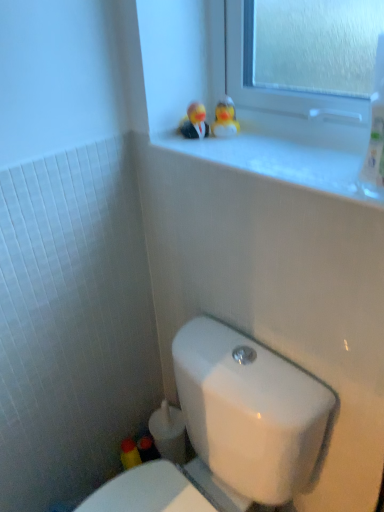
What is the approximate width of white glossy toilet at lower center?

white glossy toilet at lower center is 23.71 inches wide.

What is the approximate width of white glossy window sill at upper center?

9.50 inches.

What is the approximate height of white glossy window sill at upper center?

white glossy window sill at upper center is 0.57 inches tall.

What do you see at coordinates (194, 122) in the screenshot? Image resolution: width=384 pixels, height=512 pixels. I see `rubber duck at upper center, the second miniature from the right` at bounding box center [194, 122].

Where is `rubber duckies at upper center, the 2th miniature when ordered from left to right`? This screenshot has width=384, height=512. rubber duckies at upper center, the 2th miniature when ordered from left to right is located at coordinates (225, 119).

Locate an element on the screen. The image size is (384, 512). white glossy toilet at lower center is located at coordinates (231, 428).

What are the coordinates of `toilet in front of the rubber duckies at upper center, the 2th miniature when ordered from left to right` in the screenshot? It's located at (231, 428).

Based on the photo, what's the angular difference between rubber duckies at upper center, which is the first miniature in right-to-left order, and white glossy toilet at lower center's facing directions?

The angular difference between rubber duckies at upper center, which is the first miniature in right-to-left order, and white glossy toilet at lower center is 54.6 degrees.

In the scene shown: Is rubber duckies at upper center, which is the first miniature in right-to-left order, positioned far away from white glossy toilet at lower center?

No, there isn't a large distance between rubber duckies at upper center, which is the first miniature in right-to-left order, and white glossy toilet at lower center.

Considering the relative sizes of rubber duckies at upper center, the 2th miniature when ordered from left to right, and white glossy toilet at lower center in the image provided, is rubber duckies at upper center, the 2th miniature when ordered from left to right, shorter than white glossy toilet at lower center?

Yes.

In the image, there is a rubber duckies at upper center, the 2th miniature when ordered from left to right. At what (x,y) coordinates should I click in order to perform the action: click on window sill below it (from the image's perspective). Please return your answer as a coordinate pair (x, y). Looking at the image, I should click on (289, 155).

Is rubber duckies at upper center, which is the first miniature in right-to-left order, inside white glossy window sill at upper center?

No, rubber duckies at upper center, which is the first miniature in right-to-left order, is not a part of white glossy window sill at upper center.

Which of these two, white glossy window sill at upper center or rubber duckies at upper center, which is the first miniature in right-to-left order, is wider?

With larger width is white glossy window sill at upper center.

Is white glossy toilet at lower center bigger than rubber duck at upper center, the second miniature from the right?

Yes.

From the image's perspective, is white glossy toilet at lower center over rubber duck at upper center, placed as the 1th miniature when sorted from left to right?

No.

Is white glossy toilet at lower center looking in the opposite direction of rubber duck at upper center, the second miniature from the right?

No, white glossy toilet at lower center is not facing away from rubber duck at upper center, the second miniature from the right.

How far apart are white glossy toilet at lower center and rubber duck at upper center, the second miniature from the right?

white glossy toilet at lower center is 28.00 inches away from rubber duck at upper center, the second miniature from the right.

Can you confirm if rubber duckies at upper center, the 2th miniature when ordered from left to right, is smaller than white glossy window sill at upper center?

Yes.

Is rubber duckies at upper center, which is the first miniature in right-to-left order, completely or partially outside of white glossy window sill at upper center?

That's correct, rubber duckies at upper center, which is the first miniature in right-to-left order, is outside of white glossy window sill at upper center.

Can you tell me how much rubber duckies at upper center, which is the first miniature in right-to-left order, and white glossy window sill at upper center differ in facing direction?

Answer: The facing directions of rubber duckies at upper center, which is the first miniature in right-to-left order, and white glossy window sill at upper center are 52.7 degrees apart.

How far apart are rubber duck at upper center, placed as the 1th miniature when sorted from left to right, and white glossy window sill at upper center?

24.56 centimeters.

From the image's perspective, is rubber duck at upper center, the second miniature from the right, on top of white glossy window sill at upper center?

Yes, from the image's perspective, rubber duck at upper center, the second miniature from the right, is over white glossy window sill at upper center.

Considering the sizes of objects rubber duck at upper center, the second miniature from the right, and white glossy window sill at upper center in the image provided, who is bigger, rubber duck at upper center, the second miniature from the right, or white glossy window sill at upper center?

Bigger between the two is white glossy window sill at upper center.

Is there a large distance between rubber duck at upper center, the second miniature from the right, and white glossy window sill at upper center?

No.

Can you see rubber duck at upper center, placed as the 1th miniature when sorted from left to right, touching white glossy toilet at lower center?

No, rubber duck at upper center, placed as the 1th miniature when sorted from left to right, is not making contact with white glossy toilet at lower center.

Considering the relative sizes of rubber duck at upper center, the second miniature from the right, and white glossy toilet at lower center in the image provided, is rubber duck at upper center, the second miniature from the right, shorter than white glossy toilet at lower center?

Yes, rubber duck at upper center, the second miniature from the right, is shorter than white glossy toilet at lower center.

Considering the relative sizes of rubber duck at upper center, the second miniature from the right, and white glossy toilet at lower center in the image provided, is rubber duck at upper center, the second miniature from the right, wider than white glossy toilet at lower center?

Incorrect, the width of rubber duck at upper center, the second miniature from the right, does not surpass that of white glossy toilet at lower center.

Considering the positions of objects rubber duck at upper center, the second miniature from the right, and white glossy toilet at lower center in the image provided, who is more to the left, rubber duck at upper center, the second miniature from the right, or white glossy toilet at lower center?

white glossy toilet at lower center is more to the left.

Is white glossy window sill at upper center inside or outside of white glossy toilet at lower center?

white glossy window sill at upper center is located beyond the bounds of white glossy toilet at lower center.

Between white glossy window sill at upper center and white glossy toilet at lower center, which one has larger width?

With larger width is white glossy toilet at lower center.

From the picture: What's the angular difference between white glossy window sill at upper center and white glossy toilet at lower center's facing directions?

They differ by 1.85 degrees in their facing directions.

This screenshot has height=512, width=384. I want to click on toilet in front of the rubber duckies at upper center, which is the first miniature in right-to-left order, so click(x=231, y=428).

At what (x,y) coordinates should I click in order to perform the action: click on the 2nd miniature behind the white glossy window sill at upper center, counting from the anchor's position. Please return your answer as a coordinate pair (x, y). Looking at the image, I should click on (225, 119).

When comparing their distances from rubber duckies at upper center, the 2th miniature when ordered from left to right, does rubber duck at upper center, the second miniature from the right, or white glossy window sill at upper center seem further?

Among the two, white glossy window sill at upper center is located further to rubber duckies at upper center, the 2th miniature when ordered from left to right.

When comparing their distances from rubber duckies at upper center, the 2th miniature when ordered from left to right, does white glossy toilet at lower center or rubber duck at upper center, the second miniature from the right, seem closer?

The object closer to rubber duckies at upper center, the 2th miniature when ordered from left to right, is rubber duck at upper center, the second miniature from the right.

When comparing their distances from white glossy toilet at lower center, does white glossy window sill at upper center or rubber duckies at upper center, which is the first miniature in right-to-left order, seem further?

rubber duckies at upper center, which is the first miniature in right-to-left order, is further to white glossy toilet at lower center.

Looking at the image, which one is located closer to white glossy window sill at upper center, rubber duckies at upper center, which is the first miniature in right-to-left order, or white glossy toilet at lower center?

The object closer to white glossy window sill at upper center is rubber duckies at upper center, which is the first miniature in right-to-left order.

Based on the photo, looking at the image, which one is located further to white glossy toilet at lower center, white glossy window sill at upper center or rubber duck at upper center, placed as the 1th miniature when sorted from left to right?

rubber duck at upper center, placed as the 1th miniature when sorted from left to right, lies further to white glossy toilet at lower center than the other object.

Estimate the real-world distances between objects in this image. Which object is closer to white glossy toilet at lower center, rubber duckies at upper center, which is the first miniature in right-to-left order, or white glossy window sill at upper center?

white glossy window sill at upper center is positioned closer to the anchor white glossy toilet at lower center.

Considering their positions, is rubber duckies at upper center, which is the first miniature in right-to-left order, positioned closer to rubber duck at upper center, the second miniature from the right, than white glossy window sill at upper center?

The object closer to rubber duck at upper center, the second miniature from the right, is rubber duckies at upper center, which is the first miniature in right-to-left order.

Looking at the image, which one is located closer to white glossy window sill at upper center, rubber duck at upper center, placed as the 1th miniature when sorted from left to right, or white glossy toilet at lower center?

Among the two, rubber duck at upper center, placed as the 1th miniature when sorted from left to right, is located nearer to white glossy window sill at upper center.

You are a GUI agent. You are given a task and a screenshot of the screen. Output one action in this format:
    pyautogui.click(x=<x>, y=<y>)
    Task: Click on the window sill that lies between rubber duck at upper center, placed as the 1th miniature when sorted from left to right, and white glossy toilet at lower center from top to bottom
    This screenshot has width=384, height=512.
    Given the screenshot: What is the action you would take?
    pyautogui.click(x=289, y=155)

The width and height of the screenshot is (384, 512). I want to click on miniature that lies between rubber duckies at upper center, the 2th miniature when ordered from left to right, and white glossy toilet at lower center from top to bottom, so click(x=194, y=122).

This screenshot has height=512, width=384. In order to click on window sill between rubber duckies at upper center, the 2th miniature when ordered from left to right, and white glossy toilet at lower center from top to bottom in this screenshot , I will do `click(289, 155)`.

At what (x,y) coordinates should I click in order to perform the action: click on miniature between white glossy window sill at upper center and rubber duckies at upper center, the 2th miniature when ordered from left to right, in the front-back direction. Please return your answer as a coordinate pair (x, y). The height and width of the screenshot is (512, 384). Looking at the image, I should click on (194, 122).